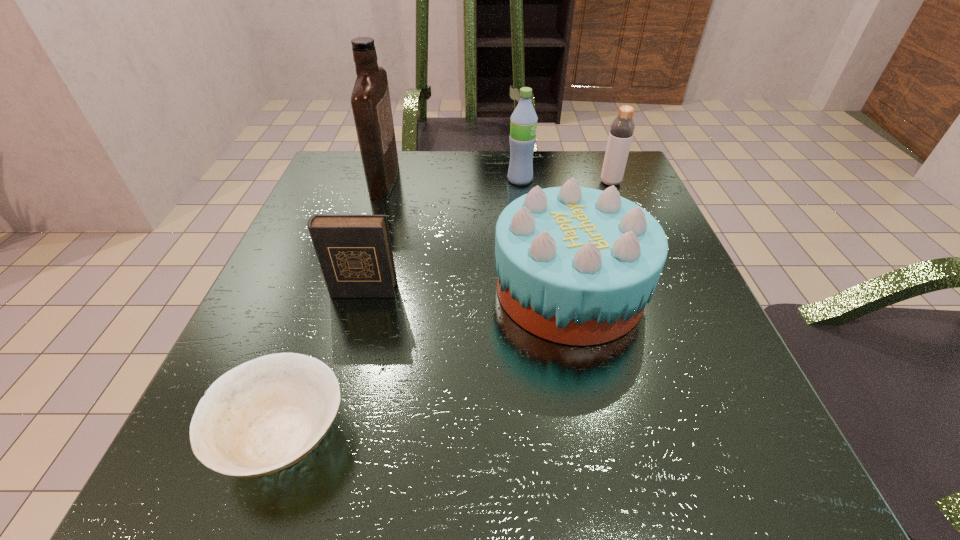
In order to click on free space located 0.260m on the back of the cake in this screenshot , I will do `click(544, 172)`.

Where is `free space located on the front cover of the diary`? Image resolution: width=960 pixels, height=540 pixels. free space located on the front cover of the diary is located at coordinates (341, 375).

At what (x,y) coordinates should I click in order to perform the action: click on free space located on the back of the shortest object. Please return your answer as a coordinate pair (x, y). Looking at the image, I should click on (330, 301).

Identify the location of liquor that is positioned at the far edge. (370, 100).

The height and width of the screenshot is (540, 960). Find the location of `water bottle at the far edge`. water bottle at the far edge is located at coordinates (523, 126).

Find the location of a particular element. bottle that is at the far edge is located at coordinates (622, 128).

This screenshot has height=540, width=960. I want to click on object present at the near edge, so click(264, 415).

Locate an element on the screen. The height and width of the screenshot is (540, 960). liquor at the left edge is located at coordinates 370,100.

Where is `diary present at the left edge`? diary present at the left edge is located at coordinates (355, 254).

Locate an element on the screen. bowl positioned at the left edge is located at coordinates (264, 415).